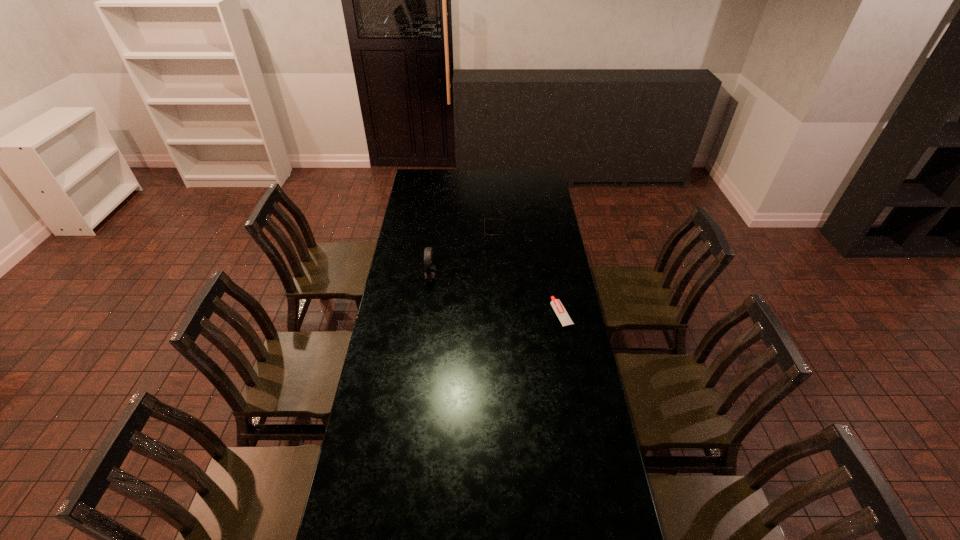
Identify the location of the leftmost object. (430, 271).

In order to click on the tallest object in this screenshot , I will do `click(430, 271)`.

Identify the location of the farthest object. This screenshot has width=960, height=540. (484, 218).

The height and width of the screenshot is (540, 960). I want to click on the second tallest object, so click(484, 218).

I want to click on the nearest object, so click(x=556, y=304).

Where is `the rightmost object`? This screenshot has height=540, width=960. the rightmost object is located at coordinates (556, 304).

Locate an element on the screen. This screenshot has height=540, width=960. vacant space situated on the front-facing side of the tallest object is located at coordinates (449, 278).

Find the location of a particular element. free space located on the front-facing side of the second object from left to right is located at coordinates (425, 232).

This screenshot has height=540, width=960. Identify the location of free space located 0.160m on the front-facing side of the second object from left to right. (454, 232).

Where is `vacant space situated on the front-facing side of the second object from left to right`? Image resolution: width=960 pixels, height=540 pixels. vacant space situated on the front-facing side of the second object from left to right is located at coordinates (415, 232).